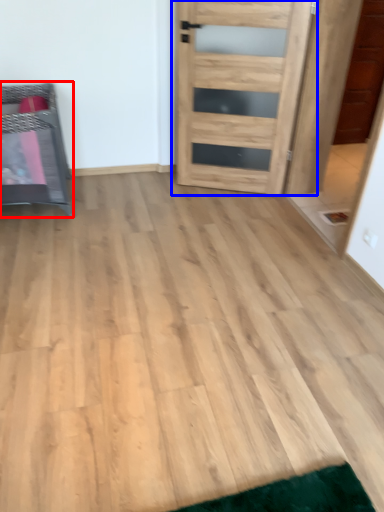
Question: Which object appears closest to the camera in this image, furniture (highlighted by a red box) or door (highlighted by a blue box)?

Choices:
 (A) furniture
 (B) door

Answer: (A)